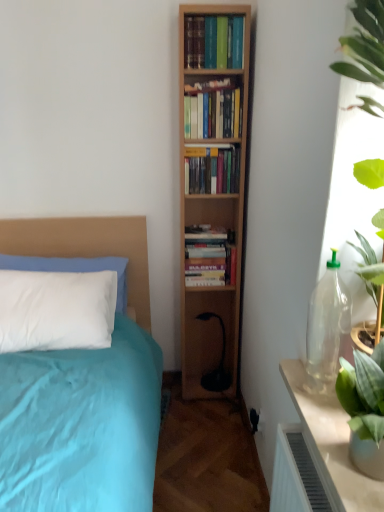
Question: In which direction should I rotate to look at hardcover books at center, positioned as the 1th book in top-to-bottom order?

Choices:
 (A) left
 (B) right

Answer: (B)

Question: Does hardcover books at center, positioned as the 1th book in top-to-bottom order, have a lesser width compared to translucent glass table at right?

Choices:
 (A) yes
 (B) no

Answer: (A)

Question: Is hardcover books at center, positioned as the fourth book in bottom-to-top order, next to translucent glass table at right?

Choices:
 (A) yes
 (B) no

Answer: (B)

Question: Does hardcover books at center, positioned as the fourth book in bottom-to-top order, have a larger size compared to translucent glass table at right?

Choices:
 (A) yes
 (B) no

Answer: (B)

Question: Are hardcover books at center, positioned as the fourth book in bottom-to-top order, and translucent glass table at right located far from each other?

Choices:
 (A) yes
 (B) no

Answer: (A)

Question: Considering the relative sizes of hardcover books at center, positioned as the fourth book in bottom-to-top order, and translucent glass table at right in the image provided, is hardcover books at center, positioned as the fourth book in bottom-to-top order, taller than translucent glass table at right?

Choices:
 (A) no
 (B) yes

Answer: (A)

Question: Is hardcover books at center, positioned as the 1th book in top-to-bottom order, to the right of translucent glass table at right from the viewer's perspective?

Choices:
 (A) no
 (B) yes

Answer: (A)

Question: Is hardcover books at center, which is the 1th book from bottom to top, completely or partially inside translucent glass table at right?

Choices:
 (A) yes
 (B) no

Answer: (B)

Question: Can you confirm if translucent glass table at right is shorter than hardcover books at center, which ranks as the fourth book in top-to-bottom order?

Choices:
 (A) no
 (B) yes

Answer: (B)

Question: Are translucent glass table at right and hardcover books at center, which ranks as the fourth book in top-to-bottom order, far apart?

Choices:
 (A) no
 (B) yes

Answer: (B)

Question: Would you say translucent glass table at right is outside hardcover books at center, which is the 1th book from bottom to top?

Choices:
 (A) yes
 (B) no

Answer: (A)

Question: Is translucent glass table at right next to hardcover books at center, which is the 1th book from bottom to top?

Choices:
 (A) no
 (B) yes

Answer: (A)

Question: Is translucent glass table at right further to camera compared to hardcover books at center, which is the 1th book from bottom to top?

Choices:
 (A) no
 (B) yes

Answer: (A)

Question: Is translucent glass table at right shorter than hardcover books at center, positioned as the 1th book in top-to-bottom order?

Choices:
 (A) yes
 (B) no

Answer: (B)